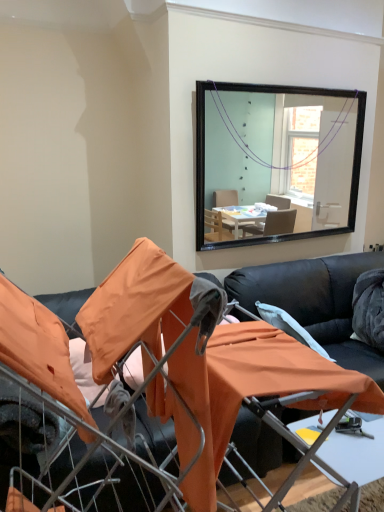
The height and width of the screenshot is (512, 384). Describe the element at coordinates (253, 387) in the screenshot. I see `black leather couch at center` at that location.

Image resolution: width=384 pixels, height=512 pixels. What do you see at coordinates (315, 302) in the screenshot?
I see `black leather couch at center` at bounding box center [315, 302].

What do you see at coordinates (359, 461) in the screenshot?
I see `white plastic table at lower center` at bounding box center [359, 461].

Image resolution: width=384 pixels, height=512 pixels. I want to click on black leather couch at center, so click(x=253, y=387).

The image size is (384, 512). I want to click on table below the black leather couch at center (from the image's perspective), so [359, 461].

Can you confirm if black leather couch at center is shorter than white plastic table at lower center?

→ In fact, black leather couch at center may be taller than white plastic table at lower center.

How different are the orientations of black leather couch at center and white plastic table at lower center in degrees?

There is a 1.37-degree angle between the facing directions of black leather couch at center and white plastic table at lower center.

Considering the relative sizes of white plastic table at lower center and black leather couch at center in the image provided, is white plastic table at lower center shorter than black leather couch at center?

Yes.

From the image's perspective, which one is positioned lower, white plastic table at lower center or black leather couch at center?

white plastic table at lower center, from the image's perspective.

Does point (379, 476) lie in front of point (287, 280)?

That is True.

Is white plastic table at lower center thinner than black leather couch at center?

Indeed, white plastic table at lower center has a lesser width compared to black leather couch at center.

At what (x,y) coordinates should I click in order to perform the action: click on couch behind the black leather couch at center. Please return your answer as a coordinate pair (x, y). Image resolution: width=384 pixels, height=512 pixels. Looking at the image, I should click on (315, 302).

Are black leather couch at center and black leather couch at center located far from each other?

Yes.

Can you confirm if black leather couch at center is taller than black leather couch at center?

No, black leather couch at center is not taller than black leather couch at center.

Looking at this image, who is smaller, black leather couch at center or black leather couch at center?

Smaller between the two is black leather couch at center.

Can we say black leather couch at center lies outside black leather couch at center?

→ That's correct, black leather couch at center is outside of black leather couch at center.

Is black leather couch at center shorter than black leather couch at center?

No, black leather couch at center is not shorter than black leather couch at center.

Does black leather couch at center lie in front of black leather couch at center?

Yes, black leather couch at center is in front of black leather couch at center.

Which of these two, black leather couch at center or black leather couch at center, is smaller?

black leather couch at center is smaller.

Which is in front, white plastic table at lower center or black leather couch at center?

black leather couch at center.

Which of these two, white plastic table at lower center or black leather couch at center, is wider?

black leather couch at center is wider.

Which is closer, (364, 468) or (251, 365)?

The point (251, 365) is in front.

Is white plastic table at lower center looking in the opposite direction of black leather couch at center?

That's not correct — white plastic table at lower center is not looking away from black leather couch at center.

This screenshot has height=512, width=384. In the image, there is a black leather couch at center. Identify the location of table below it (from a real-world perspective). (359, 461).

Which is correct: black leather couch at center is inside white plastic table at lower center, or outside of it?

black leather couch at center cannot be found inside white plastic table at lower center.

Is black leather couch at center in contact with white plastic table at lower center?

They are not placed beside each other.

Consider the image. Is black leather couch at center bigger than white plastic table at lower center?

Yes.

You are a GUI agent. You are given a task and a screenshot of the screen. Output one action in this format:
    pyautogui.click(x=<x>, y=<y>)
    Task: Click on the table on the right of black leather couch at center
    Image resolution: width=384 pixels, height=512 pixels.
    Given the screenshot: What is the action you would take?
    pyautogui.click(x=359, y=461)

The width and height of the screenshot is (384, 512). Identify the location of couch located behind the white plastic table at lower center. [315, 302].

Based on their spatial positions, is black leather couch at center or black leather couch at center further from white plastic table at lower center?

black leather couch at center lies further to white plastic table at lower center than the other object.

Based on their spatial positions, is white plastic table at lower center or black leather couch at center further from black leather couch at center?

black leather couch at center is further to black leather couch at center.

Considering their positions, is black leather couch at center positioned further to white plastic table at lower center than black leather couch at center?

The object further to white plastic table at lower center is black leather couch at center.

Based on their spatial positions, is black leather couch at center or white plastic table at lower center further from black leather couch at center?

The object further to black leather couch at center is black leather couch at center.

Which object lies nearer to the anchor point black leather couch at center, black leather couch at center or white plastic table at lower center?

white plastic table at lower center is closer to black leather couch at center.

Considering their positions, is white plastic table at lower center positioned further to black leather couch at center than black leather couch at center?

black leather couch at center.

Identify the location of table located between black leather couch at center and black leather couch at center in the depth direction. Image resolution: width=384 pixels, height=512 pixels. (359, 461).